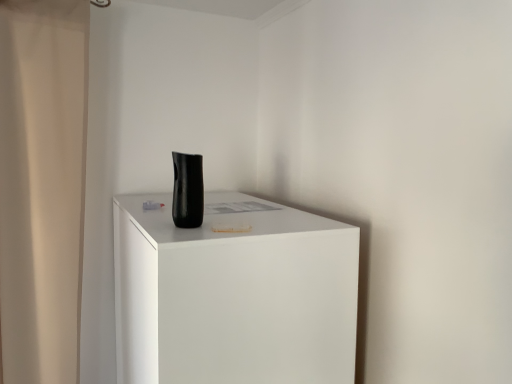
Question: Is matte black vase at center oriented away from beige fabric shower curtain at left?

Choices:
 (A) no
 (B) yes

Answer: (A)

Question: Can you confirm if matte black vase at center is smaller than beige fabric shower curtain at left?

Choices:
 (A) yes
 (B) no

Answer: (B)

Question: Are matte black vase at center and beige fabric shower curtain at left far apart?

Choices:
 (A) no
 (B) yes

Answer: (A)

Question: Would you say matte black vase at center contains beige fabric shower curtain at left?

Choices:
 (A) no
 (B) yes

Answer: (A)

Question: From the image's perspective, is matte black vase at center located above beige fabric shower curtain at left?

Choices:
 (A) yes
 (B) no

Answer: (B)

Question: Can you confirm if matte black vase at center is thinner than beige fabric shower curtain at left?

Choices:
 (A) yes
 (B) no

Answer: (B)

Question: Does matte black vase at center have a smaller size compared to black matte vase at center?

Choices:
 (A) no
 (B) yes

Answer: (A)

Question: Is matte black vase at center outside of black matte vase at center?

Choices:
 (A) yes
 (B) no

Answer: (A)

Question: Considering the relative sizes of matte black vase at center and black matte vase at center in the image provided, is matte black vase at center shorter than black matte vase at center?

Choices:
 (A) yes
 (B) no

Answer: (B)

Question: Are matte black vase at center and black matte vase at center beside each other?

Choices:
 (A) yes
 (B) no

Answer: (B)

Question: From the image's perspective, is matte black vase at center located beneath black matte vase at center?

Choices:
 (A) yes
 (B) no

Answer: (A)

Question: Is matte black vase at center further to camera compared to black matte vase at center?

Choices:
 (A) no
 (B) yes

Answer: (A)

Question: Is black matte vase at center to the left of beige fabric shower curtain at left from the viewer's perspective?

Choices:
 (A) no
 (B) yes

Answer: (A)